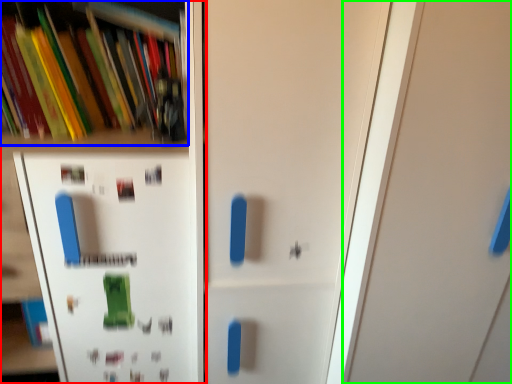
Question: Which is farther away from shelf (highlighted by a red box)? book (highlighted by a blue box) or door (highlighted by a green box)?

Choices:
 (A) book
 (B) door

Answer: (B)